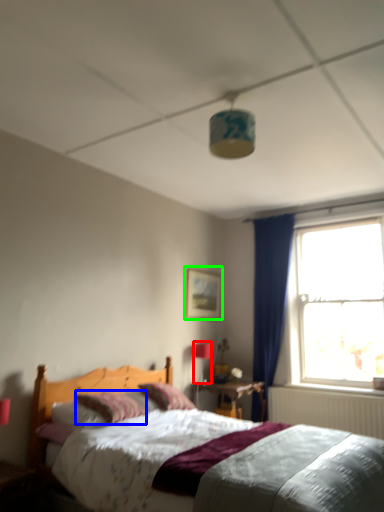
Question: Estimate the real-world distances between objects in this image. Which object is farther from light fixture (highlighted by a red box), pillow (highlighted by a blue box) or picture frame (highlighted by a green box)?

Choices:
 (A) pillow
 (B) picture frame

Answer: (A)